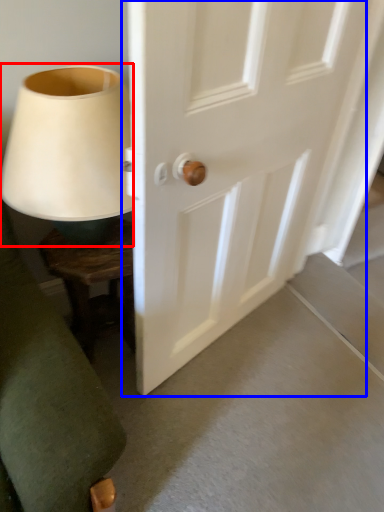
Question: Which object appears farthest to the camera in this image, table lamp (highlighted by a red box) or door (highlighted by a blue box)?

Choices:
 (A) table lamp
 (B) door

Answer: (A)